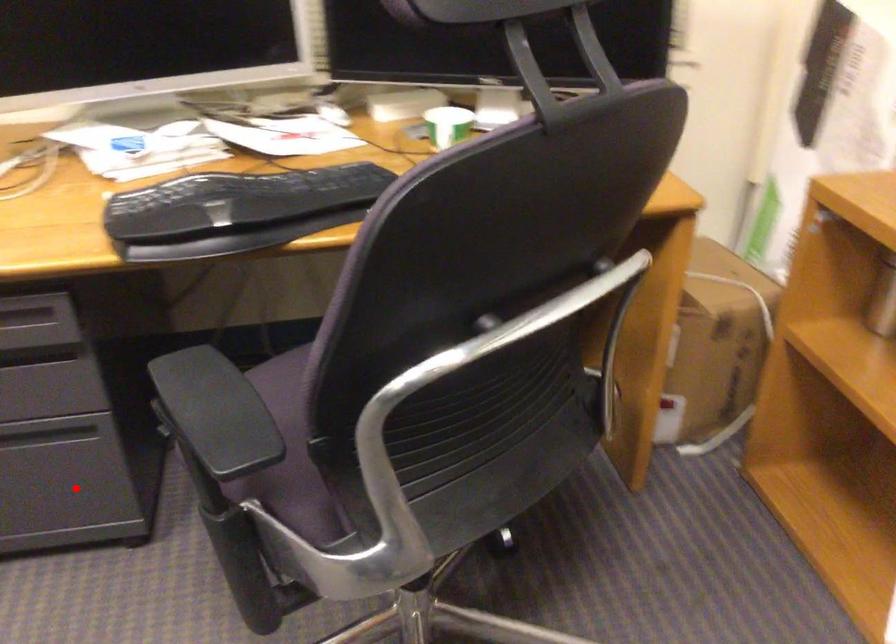
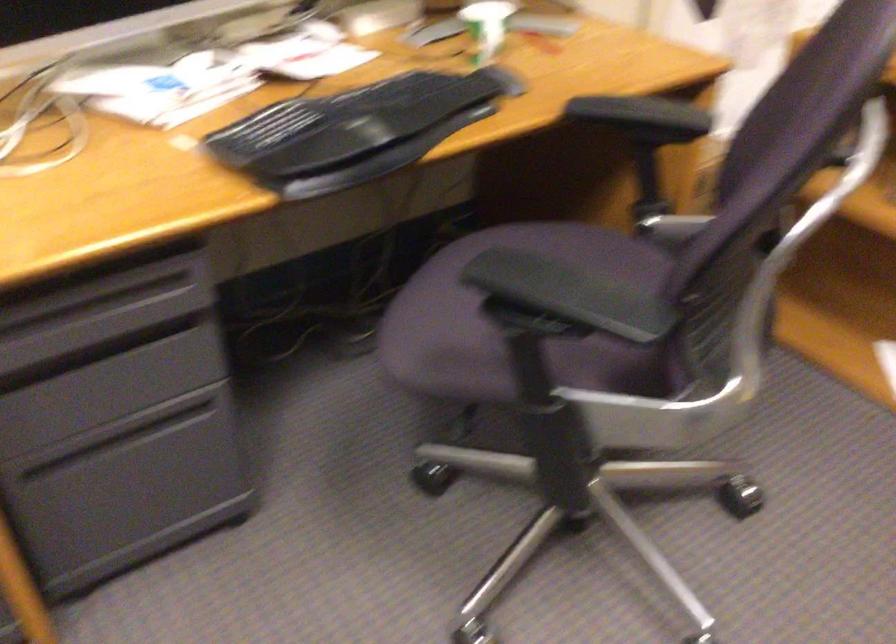
Locate, in the second image, the point that corresponds to the highlighted location in the first image.

(197, 471)